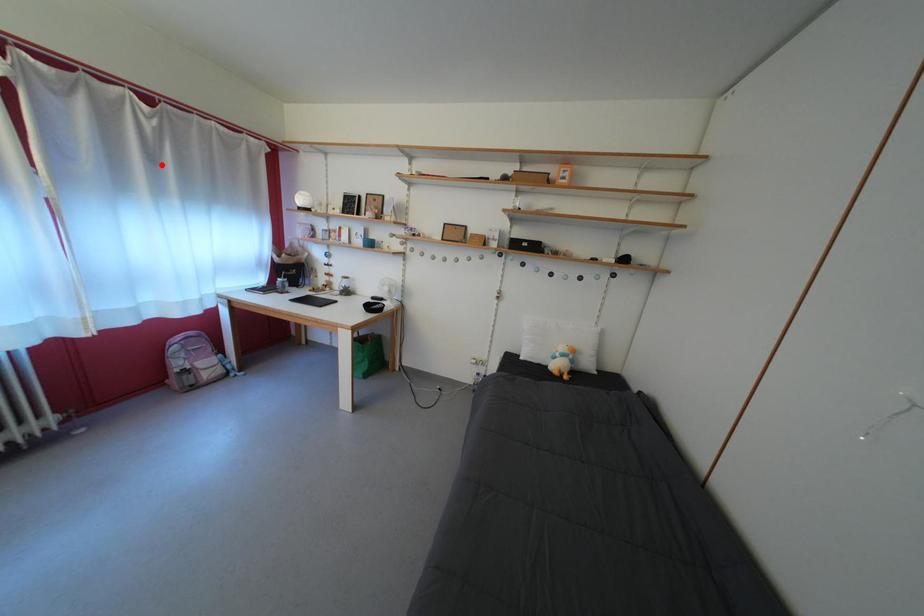
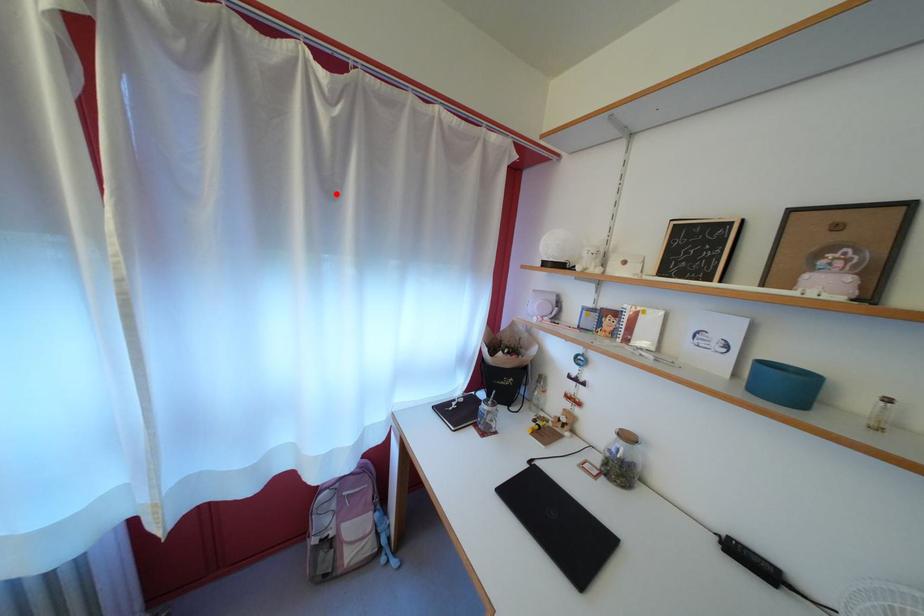
I am providing you with two images of the same scene from different viewpoints. A red point is marked on the first image and another point is marked on the second image. Does the point marked in image1 correspond to the same location as the one in image2?

Yes